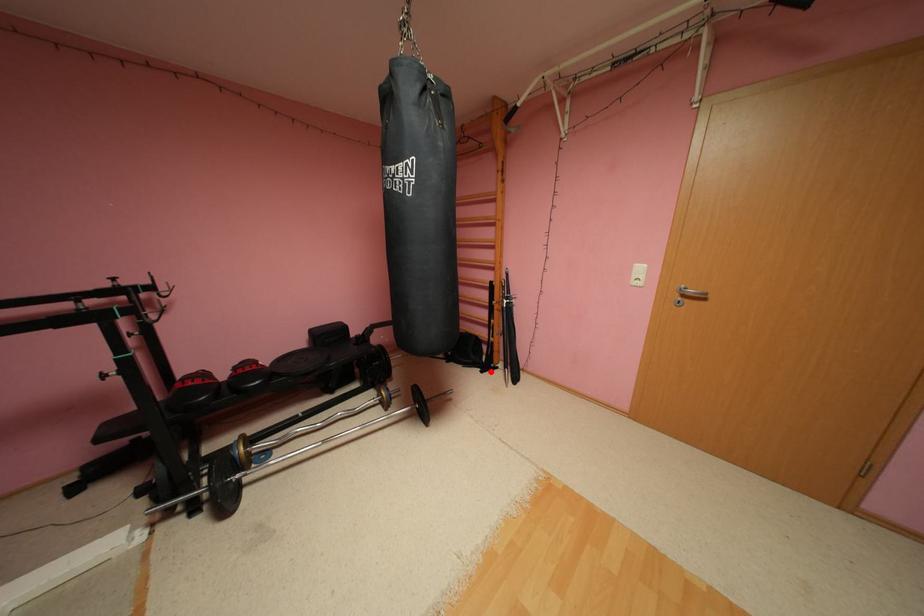
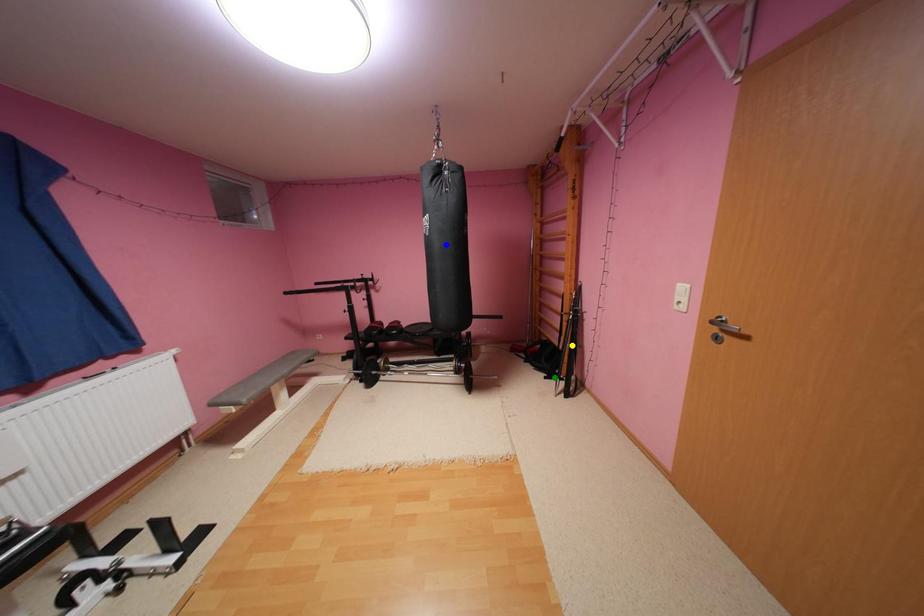
Question: I am providing you with two images of the same scene from different viewpoints. A red point is marked on the first image. You are given multiple points on the second image. Can you choose the point in image 2 that corresponds to the point in image 1?

Choices:
 (A) yellow point
 (B) blue point
 (C) green point

Answer: (C)